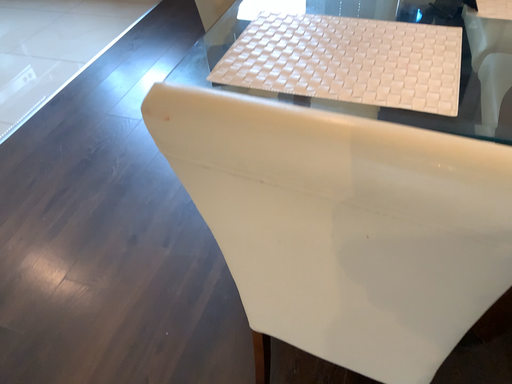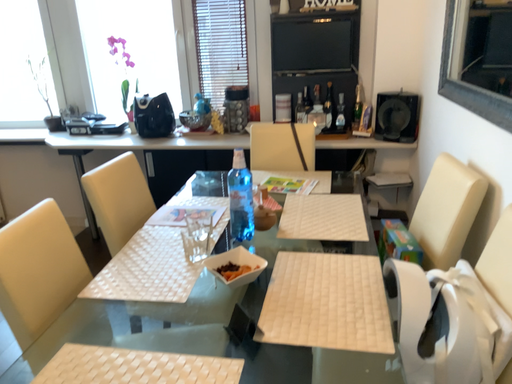
Question: Which way did the camera rotate in the video?

Choices:
 (A) rotated upward
 (B) rotated downward

Answer: (A)